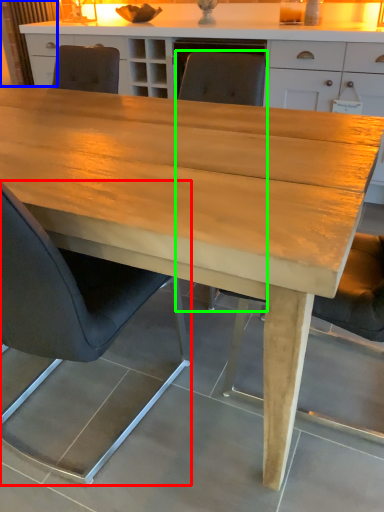
Question: Which is nearer to the chair (highlighted by a red box)? curtain (highlighted by a blue box) or chair (highlighted by a green box).

Choices:
 (A) curtain
 (B) chair

Answer: (B)